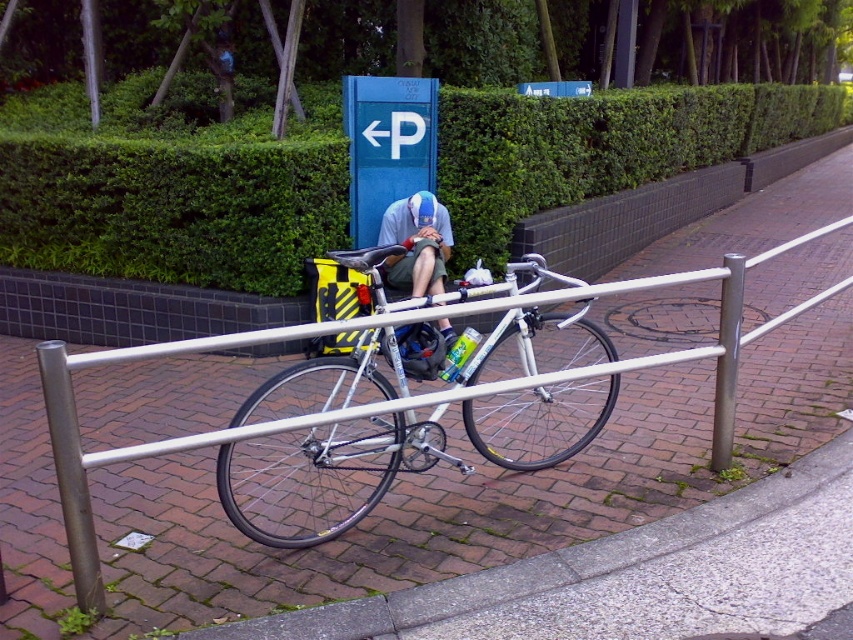
Consider the image. Can you confirm if green leafy hedge at upper center is bigger than white metallic bicycle at center?

Correct, green leafy hedge at upper center is larger in size than white metallic bicycle at center.

Who is lower down, green leafy hedge at upper center or white metallic bicycle at center?

white metallic bicycle at center is lower down.

Is point (0, 140) in front of point (352, 461)?

No, (0, 140) is behind (352, 461).

Locate an element on the screen. This screenshot has height=640, width=853. green leafy hedge at upper center is located at coordinates (173, 208).

Which is below, green leafy hedge at upper center or light blue fabric cap at center?

Positioned lower is light blue fabric cap at center.

Where is `green leafy hedge at upper center`? This screenshot has height=640, width=853. green leafy hedge at upper center is located at coordinates (173, 208).

Which is more to the left, white metallic bicycle at center or light blue fabric cap at center?

Positioned to the left is light blue fabric cap at center.

Does white metallic bicycle at center have a larger size compared to light blue fabric cap at center?

Yes.

The image size is (853, 640). Find the location of `white metallic bicycle at center`. white metallic bicycle at center is located at coordinates (323, 474).